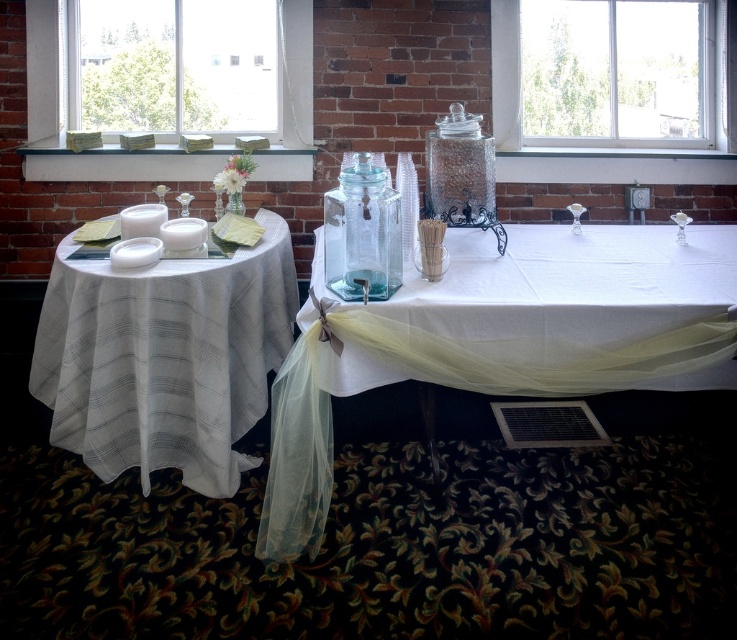
Consider the image. You are standing in the reception area and want to move from point A to point B. Point A is at coordinate point (x=654, y=144) and point B is at coordinate point (x=146, y=212). Which direction should you move to go from point A to point B?

To move from point A to point B, you should move downward and to the right since point B is located at a lower y coordinate and a higher x coordinate compared to point A.